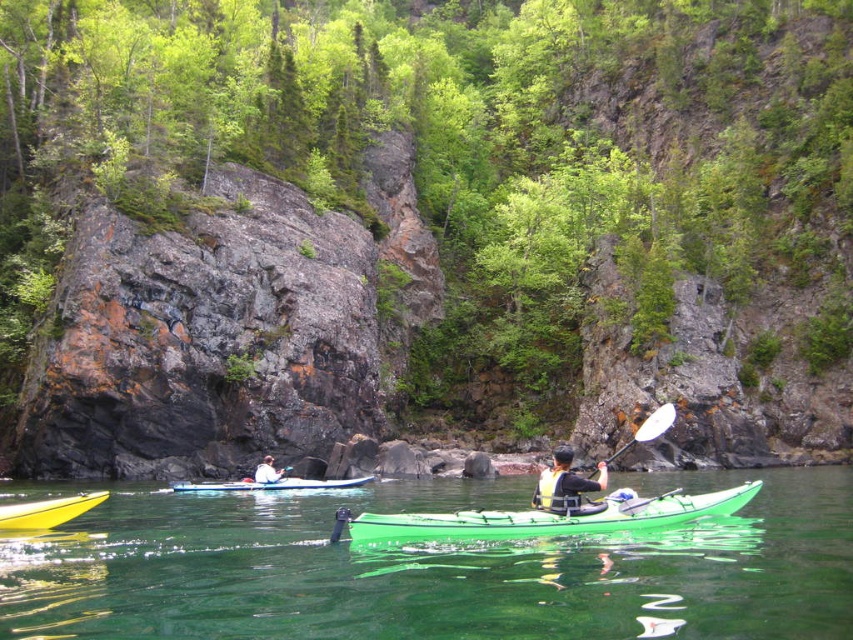
Question: Does green plastic kayak at center appear under yellow life vest at center?

Choices:
 (A) no
 (B) yes

Answer: (A)

Question: Estimate the real-world distances between objects in this image. Which object is closer to the green plastic kayak at center?

Choices:
 (A) white fabric kayak at center
 (B) yellow life vest at center
 (C) white plastic paddle at center-right
 (D) yellow plastic canoe at lower left

Answer: (D)

Question: In this image, where is green plastic kayak at center located relative to white plastic paddle at center-right?

Choices:
 (A) above
 (B) below

Answer: (B)

Question: Which object is farther from the camera taking this photo?

Choices:
 (A) white plastic paddle at center
 (B) white plastic paddle at center-right
 (C) green plastic kayak at center
 (D) yellow plastic canoe at lower left

Answer: (B)

Question: Which point is closer to the camera taking this photo?

Choices:
 (A) (51, 588)
 (B) (556, 461)
 (C) (619, 449)
 (D) (271, 490)

Answer: (A)

Question: Can you confirm if green matte kayak at center is positioned to the right of yellow life vest at center?

Choices:
 (A) no
 (B) yes

Answer: (A)